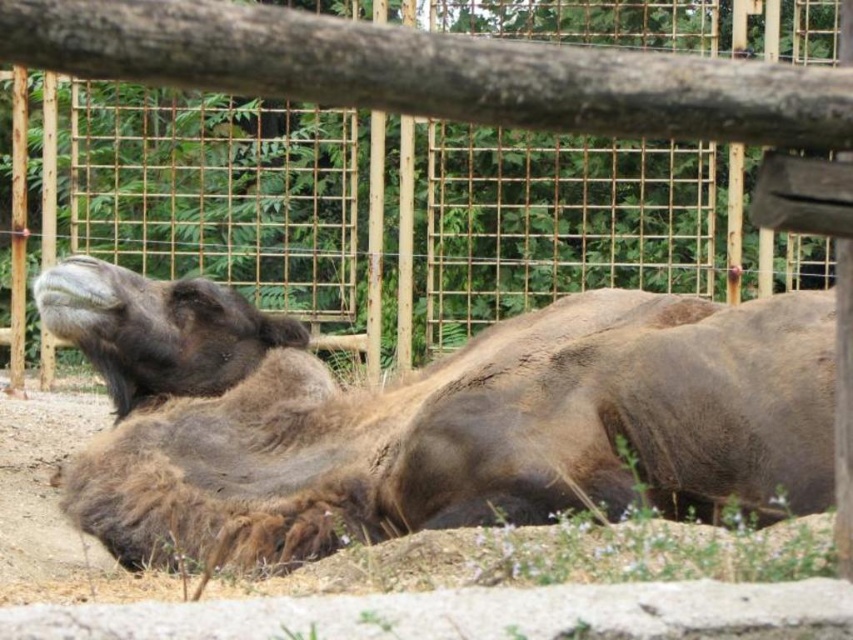
Question: Is brown fuzzy camel at center to the left of wooden fence at upper center from the viewer's perspective?

Choices:
 (A) yes
 (B) no

Answer: (A)

Question: Is brown fuzzy camel at center to the left of wooden fence at upper center from the viewer's perspective?

Choices:
 (A) yes
 (B) no

Answer: (A)

Question: Among these points, which one is farthest from the camera?

Choices:
 (A) (206, 83)
 (B) (389, 460)

Answer: (B)

Question: From the image, what is the correct spatial relationship of brown fuzzy camel at center in relation to wooden fence at upper center?

Choices:
 (A) left
 (B) right

Answer: (A)